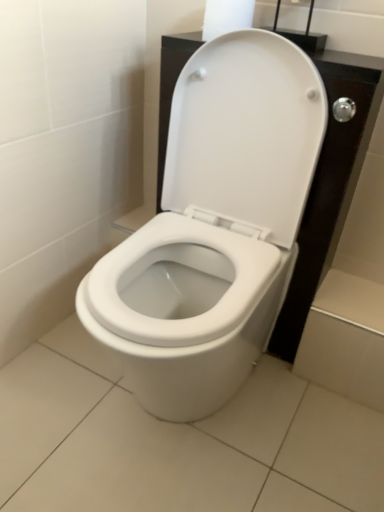
Question: Can you confirm if white glossy toilet at center is smaller than white paper at upper center?

Choices:
 (A) yes
 (B) no

Answer: (B)

Question: Would you consider white glossy toilet at center to be distant from white paper at upper center?

Choices:
 (A) yes
 (B) no

Answer: (B)

Question: Does white glossy toilet at center contain white paper at upper center?

Choices:
 (A) no
 (B) yes

Answer: (A)

Question: Is white glossy toilet at center positioned beyond the bounds of white paper at upper center?

Choices:
 (A) yes
 (B) no

Answer: (A)

Question: From the image's perspective, does white glossy toilet at center appear lower than white paper at upper center?

Choices:
 (A) yes
 (B) no

Answer: (A)

Question: From a real-world perspective, is white glossy toilet at center physically below white paper at upper center?

Choices:
 (A) no
 (B) yes

Answer: (B)

Question: From a real-world perspective, is white paper at upper center on white glossy toilet at center?

Choices:
 (A) yes
 (B) no

Answer: (A)

Question: Is white paper at upper center placed right next to white glossy toilet at center?

Choices:
 (A) no
 (B) yes

Answer: (A)

Question: Does white paper at upper center have a lesser height compared to white glossy toilet at center?

Choices:
 (A) yes
 (B) no

Answer: (A)

Question: Considering the relative sizes of white paper at upper center and white glossy toilet at center in the image provided, is white paper at upper center wider than white glossy toilet at center?

Choices:
 (A) no
 (B) yes

Answer: (A)

Question: Does white paper at upper center have a lesser width compared to white glossy toilet at center?

Choices:
 (A) no
 (B) yes

Answer: (B)

Question: Could you tell me if white paper at upper center is facing white glossy toilet at center?

Choices:
 (A) no
 (B) yes

Answer: (A)

Question: Is point (226, 3) positioned closer to the camera than point (162, 239)?

Choices:
 (A) farther
 (B) closer

Answer: (B)